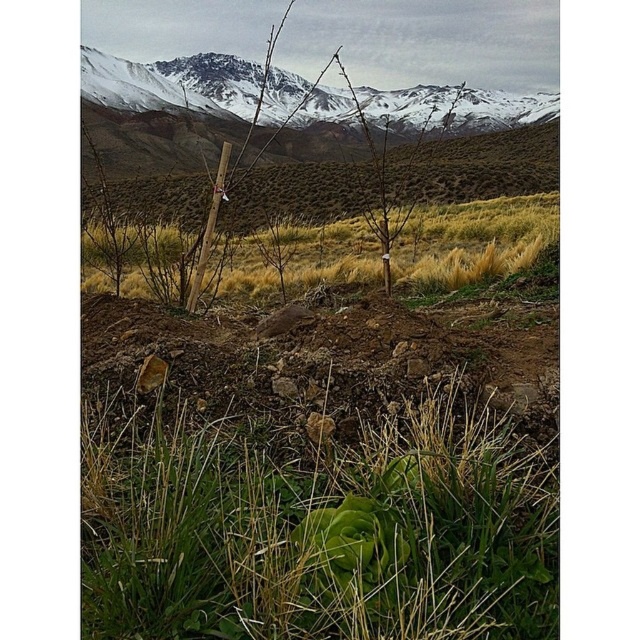
Question: Observing the image, what is the correct spatial positioning of dry grass at center in reference to snowy rock mountain at upper center?

Choices:
 (A) below
 (B) above

Answer: (A)

Question: Is green leafy grass at center further to camera compared to dry grass at center?

Choices:
 (A) no
 (B) yes

Answer: (A)

Question: Which point is farther to the camera?

Choices:
 (A) dry grass at center
 (B) snowy rock mountain at upper center

Answer: (B)

Question: Which point is closer to the camera taking this photo?

Choices:
 (A) (182, 624)
 (B) (99, 60)

Answer: (A)

Question: Can you confirm if dry grass at center is positioned to the left of snowy rock mountain at upper center?

Choices:
 (A) yes
 (B) no

Answer: (A)

Question: Which object appears closest to the camera in this image?

Choices:
 (A) dry grass at center
 (B) green leafy grass at center

Answer: (B)